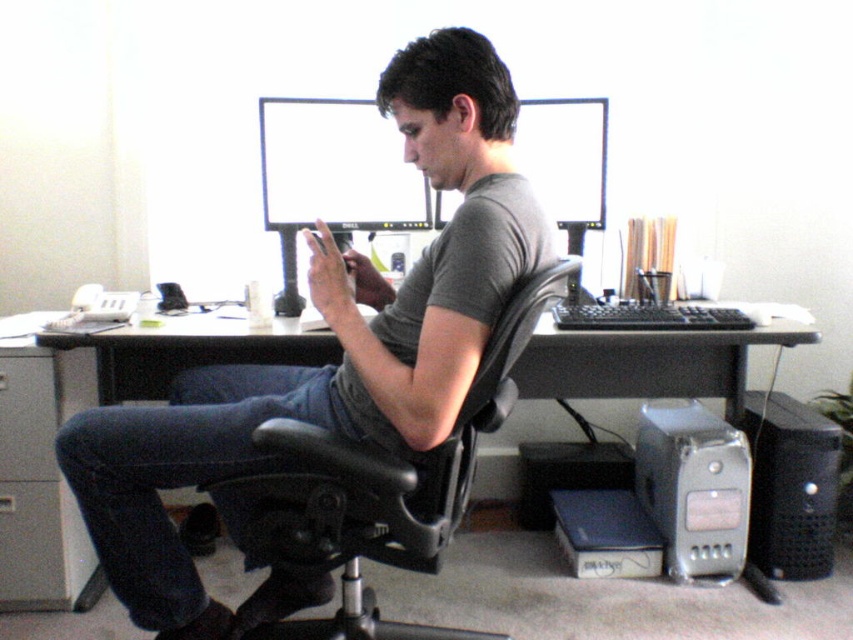
You are moving furniture in a home office. The black leather office chair at center and the black plastic computer desk at center are in the way. To move the chair first, which direction should you push it to get it out of the way of the desk?

Since the black leather office chair at center is to the left of the black plastic computer desk at center, you should push it to the right to move it out of the way of the desk.

You are organizing the desk and need to place a new item between the matte black monitor at center and the silver metallic computer at lower right. Based on their positions, which object should the new item be placed closer to?

The new item should be placed closer to the silver metallic computer at lower right because the matte black monitor at center is closer to the viewer than the silver metallic computer at lower right, meaning the silver metallic computer is further back and the item needs to be positioned between them.